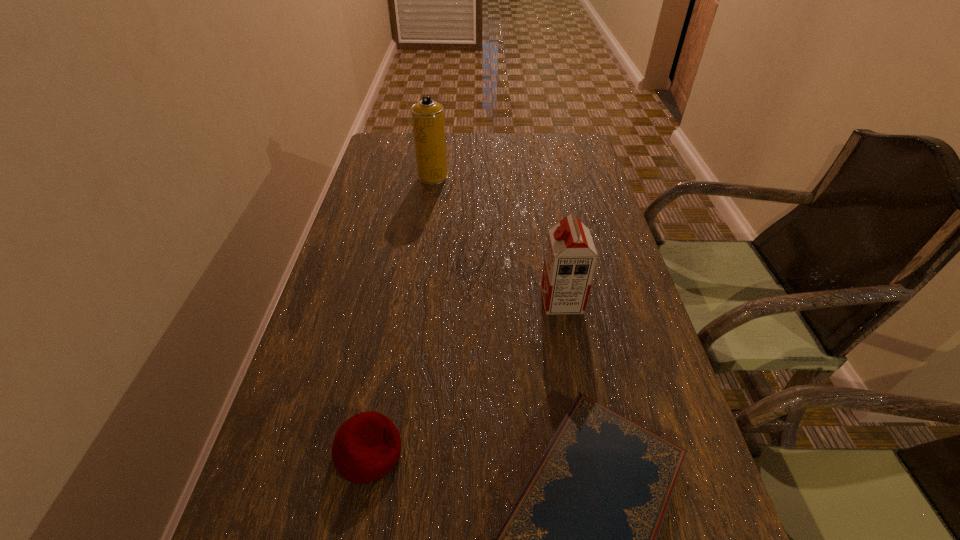
You are a GUI agent. You are given a task and a screenshot of the screen. Output one action in this format:
    pyautogui.click(x=<x>, y=<y>)
    Task: Click on the aerosol can
    
    Given the screenshot: What is the action you would take?
    pyautogui.click(x=427, y=115)

The height and width of the screenshot is (540, 960). I want to click on the second farthest object, so tap(570, 258).

You are a GUI agent. You are given a task and a screenshot of the screen. Output one action in this format:
    pyautogui.click(x=<x>, y=<y>)
    Task: Click on the third tallest object
    The height and width of the screenshot is (540, 960).
    Given the screenshot: What is the action you would take?
    pyautogui.click(x=367, y=446)

Locate an element on the screen. The width and height of the screenshot is (960, 540). vacant area situated on the front of the aerosol can is located at coordinates (420, 263).

You are a GUI agent. You are given a task and a screenshot of the screen. Output one action in this format:
    pyautogui.click(x=<x>, y=<y>)
    Task: Click on the vacant space situated 0.130m on the front of the soya milk
    This screenshot has width=960, height=540.
    Given the screenshot: What is the action you would take?
    pyautogui.click(x=573, y=363)

Find the location of `blank area located 0.230m on the seat area of the beanbag`. blank area located 0.230m on the seat area of the beanbag is located at coordinates (535, 451).

I want to click on object that is at the left edge, so click(x=367, y=446).

Locate an element on the screen. The image size is (960, 540). object present at the right edge is located at coordinates (570, 258).

Find the location of a particular element. free spot at the far edge of the desktop is located at coordinates (540, 167).

The height and width of the screenshot is (540, 960). I want to click on free space at the left edge, so click(x=306, y=343).